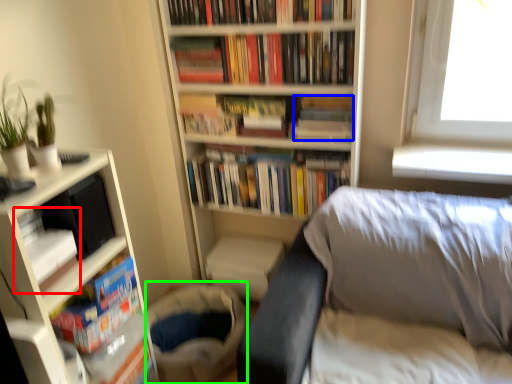
Question: Estimate the real-world distances between objects in this image. Which object is farther from book (highlighted by a red box), book (highlighted by a blue box) or gray (highlighted by a green box)?

Choices:
 (A) book
 (B) gray

Answer: (A)